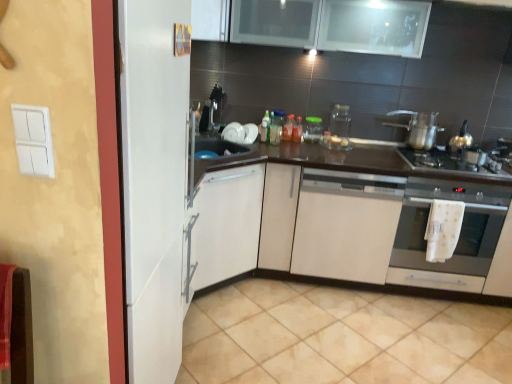
Question: Is white matte cabinet at center taller or shorter than white glossy plate at upper center, the 1th appliance in the left-to-right sequence?

Choices:
 (A) short
 (B) tall

Answer: (B)

Question: Considering the positions of point (381, 210) and point (228, 134), is point (381, 210) closer or farther from the camera than point (228, 134)?

Choices:
 (A) farther
 (B) closer

Answer: (B)

Question: Which object is the closest to the white glossy plate at upper center, which is counted as the 3th appliance, starting from the right?

Choices:
 (A) shiny metallic pot at center right
 (B) translucent plastic bottle at center, placed as the 3th bottle when sorted from left to right
 (C) gold metallic tea pot at right
 (D) dark wood countertop at center
 (E) beige tile at lower center

Answer: (B)

Question: Based on their relative distances, which object is nearer to the translucent glass bottle at center, which appears as the 1th bottle when viewed from the left?

Choices:
 (A) translucent glass jar at center, the 2th bottle when ordered from left to right
 (B) satin silver oven at lower right
 (C) white plastic light switch at left
 (D) white glossy plate at upper center, which is counted as the 3th appliance, starting from the right
 (E) gold metallic tea pot at right

Answer: (A)